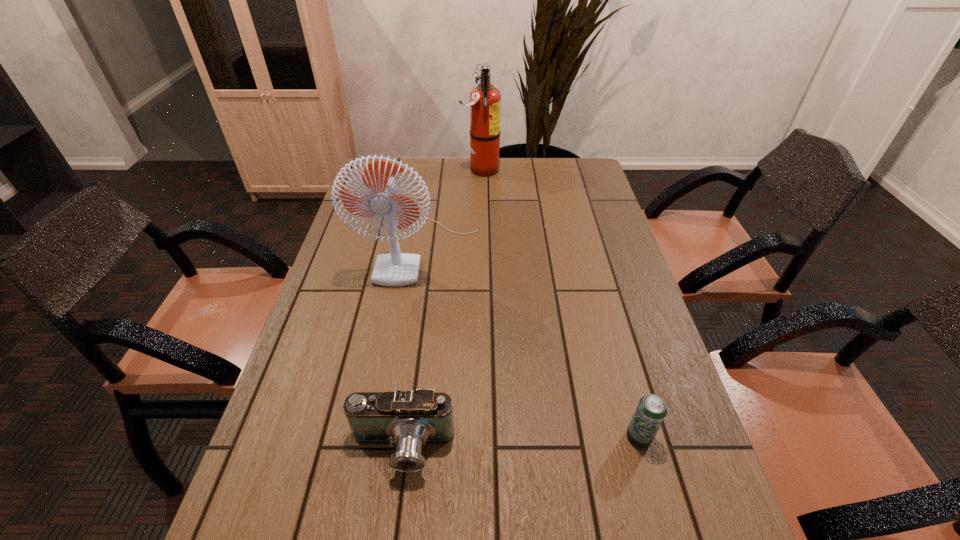
Identify the location of vacant region between the camcorder and the beer can. (520, 443).

What are the coordinates of `free area in between the camcorder and the second farthest object` in the screenshot? It's located at [412, 349].

This screenshot has height=540, width=960. I want to click on unoccupied position between the fire extinguisher and the rightmost object, so click(560, 303).

Find the location of a particular element. This screenshot has width=960, height=540. free space between the beer can and the camcorder is located at coordinates pyautogui.click(x=520, y=443).

The height and width of the screenshot is (540, 960). I want to click on free space that is in between the fan and the rightmost object, so click(530, 343).

Find the location of `unoccupied area between the beer can and the fire extinguisher`. unoccupied area between the beer can and the fire extinguisher is located at coordinates (560, 303).

Locate which object is the closest to the beer can. Please provide its 2D coordinates. Your answer should be formatted as a tuple, i.e. [(x, y)], where the tuple contains the x and y coordinates of a point satisfying the conditions above.

[(410, 419)]

Locate an element on the screen. The height and width of the screenshot is (540, 960). the closest object relative to the fire extinguisher is located at coordinates [x=394, y=269].

Identify the location of vacant area in the image that satisfies the following two spatial constraints: 1. on the front-facing side of the beer can; 2. on the left side of the third nearest object. (392, 437).

At what (x,y) coordinates should I click in order to perform the action: click on vacant area in the image that satisfies the following two spatial constraints: 1. on the front-facing side of the rightmost object; 2. on the right side of the fan. Please return your answer as a coordinate pair (x, y). The height and width of the screenshot is (540, 960). Looking at the image, I should click on (392, 437).